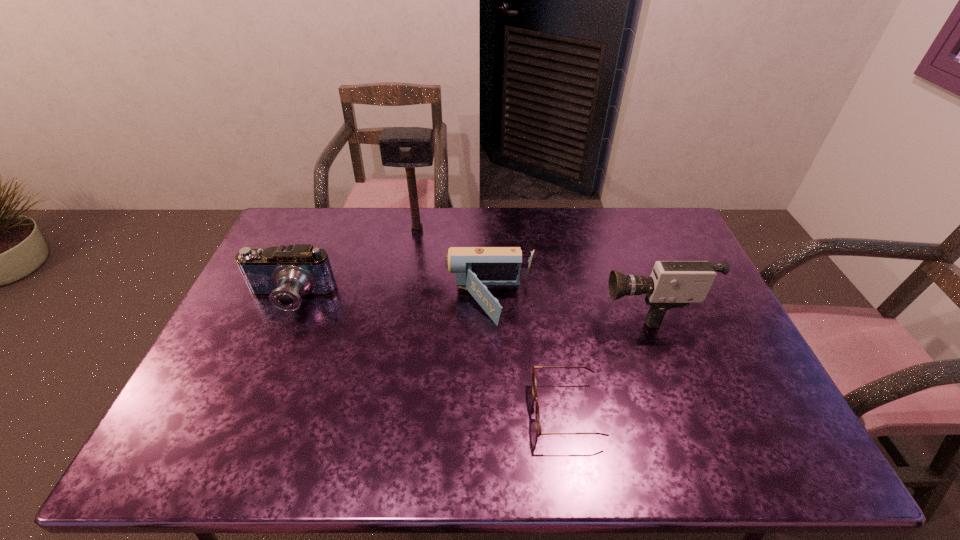
Image resolution: width=960 pixels, height=540 pixels. I want to click on vacant area situated on the recording direction of the rightmost camcorder, so click(521, 307).

Identify the location of vacant space situated on the recording direction of the rightmost camcorder. The image size is (960, 540). (574, 307).

Locate an element on the screen. The width and height of the screenshot is (960, 540). vacant area located on the front-facing side of the leftmost object is located at coordinates (224, 451).

Find the location of a particular element. The image size is (960, 540). free space located 0.230m on the side of the second camcorder from left to right with the flip-out screen is located at coordinates (370, 302).

Where is `free space located on the side of the second camcorder from left to right with the flip-out screen`? free space located on the side of the second camcorder from left to right with the flip-out screen is located at coordinates (386, 302).

The width and height of the screenshot is (960, 540). I want to click on vacant area located 0.390m on the side of the second camcorder from left to right with the flip-out screen, so click(x=317, y=302).

What are the coordinates of `free spot located 0.210m at the front view of the shortest object` in the screenshot? It's located at (448, 411).

This screenshot has height=540, width=960. I want to click on free region located at the front view of the shortest object, so click(x=378, y=411).

You are a GUI agent. You are given a task and a screenshot of the screen. Output one action in this format:
    pyautogui.click(x=<x>, y=<y>)
    Task: Click on the vacant region located at the front view of the shortest object
    
    Given the screenshot: What is the action you would take?
    pyautogui.click(x=461, y=411)

The height and width of the screenshot is (540, 960). In order to click on object that is at the far edge in this screenshot , I will do `click(409, 147)`.